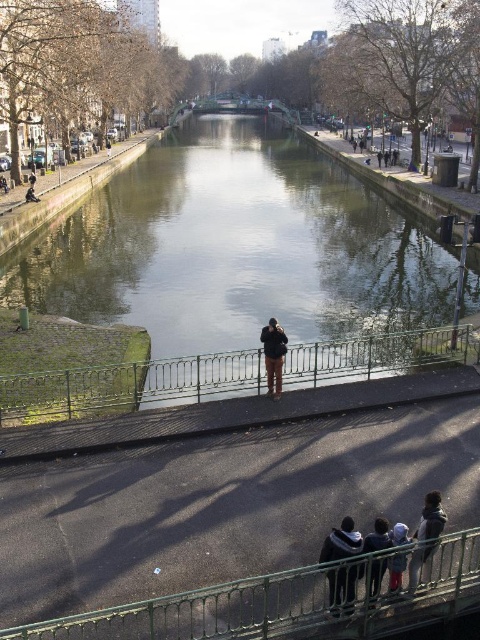
Question: Does dark gray hoodie at lower right have a smaller size compared to dark blue jeans at lower center?

Choices:
 (A) yes
 (B) no

Answer: (B)

Question: Which of the following is the farthest from the observer?

Choices:
 (A) dark blue jeans at lower center
 (B) dark gray hoodie at lower right
 (C) green metal railing at lower center
 (D) green metal railing at center

Answer: (D)

Question: Which is farther from the dark gray hoodie at lower center?

Choices:
 (A) black fabric jacket at center
 (B) green concrete river at center
 (C) dark gray hoodie at lower right
 (D) blue knit hat at lower center

Answer: (B)

Question: Considering the relative positions of green metal railing at lower center and dark gray hoodie at lower right in the image provided, where is green metal railing at lower center located with respect to dark gray hoodie at lower right?

Choices:
 (A) below
 (B) above

Answer: (A)

Question: Does green metal railing at lower center appear under blue knit hat at lower center?

Choices:
 (A) yes
 (B) no

Answer: (A)

Question: Which of these objects is positioned closest to the green concrete river at center?

Choices:
 (A) dark gray hoodie at lower right
 (B) dark gray hoodie at lower center

Answer: (B)